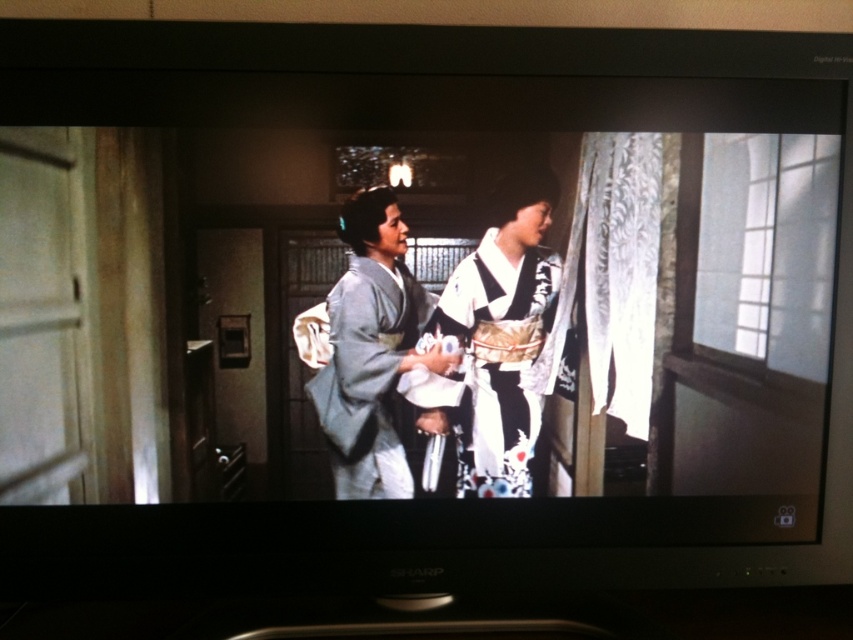
Question: Which of the following is the closest to the observer?

Choices:
 (A) (532, 323)
 (B) (381, 456)

Answer: (A)

Question: Can you confirm if white silk kimono at center is positioned to the left of light gray silk kimono at center?

Choices:
 (A) no
 (B) yes

Answer: (A)

Question: Which object is farther from the camera taking this photo?

Choices:
 (A) white silk kimono at center
 (B) light gray silk kimono at center

Answer: (A)

Question: Which of the following is the farthest from the observer?

Choices:
 (A) (469, 451)
 (B) (384, 484)

Answer: (A)

Question: Is white silk kimono at center wider than light gray silk kimono at center?

Choices:
 (A) yes
 (B) no

Answer: (A)

Question: Can you confirm if white silk kimono at center is bigger than light gray silk kimono at center?

Choices:
 (A) yes
 (B) no

Answer: (A)